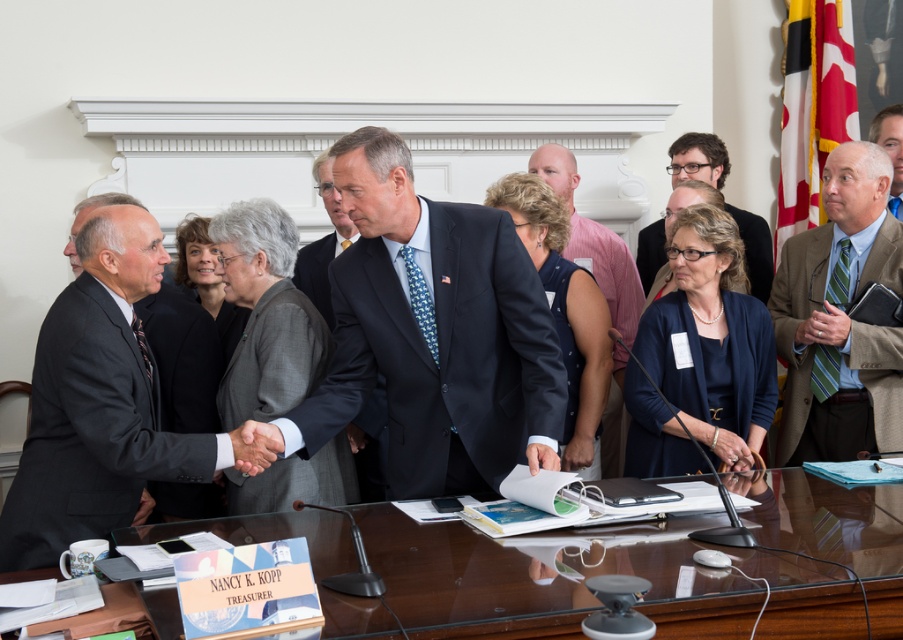
In the scene shown: You are attending a meeting and notice two people sitting at the table. One is wearing a blue suit at center and the other a gray fabric suit at center. From your perspective facing the table, which suit is positioned to the left?

The blue suit at center is positioned to the left of the gray fabric suit at center.

You are a photographer trying to capture a closeup of the blue suit at center and the matte brown leather hand at center. Which object should you zoom in on to ensure both are in frame without moving the camera?

The blue suit at center is wider than the matte brown leather hand at center, so you should zoom in on the blue suit at center to ensure both are in frame without moving the camera.